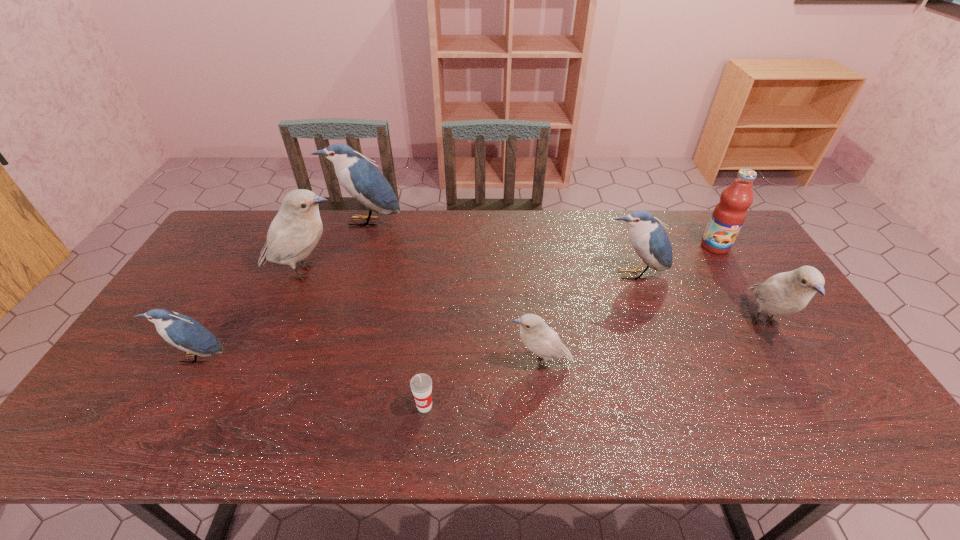
Identify the location of the fourth object from right to left. The image size is (960, 540). (536, 335).

Find the location of a particular element. Image resolution: width=960 pixels, height=540 pixels. the leftmost blue bird is located at coordinates (181, 331).

Where is `the nearest blue bird`? the nearest blue bird is located at coordinates point(181,331).

This screenshot has width=960, height=540. Identify the location of the nearest object. (421, 384).

At what (x,y) coordinates should I click in order to perform the action: click on the fourth object from left to right. Please return your answer as a coordinate pair (x, y). The image size is (960, 540). Looking at the image, I should click on (421, 384).

Identify the location of vacant space located 0.370m at the tip of the farthest object's beak. This screenshot has height=540, width=960. (337, 307).

I want to click on free space located at the beak of the biggest white bird, so click(370, 272).

You are a GUI agent. You are given a task and a screenshot of the screen. Output one action in this format:
    pyautogui.click(x=<x>, y=<y>)
    Task: Click on the vacant space located 0.400m on the front label of the fruit juice
    This screenshot has height=540, width=960.
    Given the screenshot: What is the action you would take?
    pyautogui.click(x=781, y=353)

You are a GUI agent. You are given a task and a screenshot of the screen. Output one action in this format:
    pyautogui.click(x=<x>, y=<y>)
    Task: Click on the free space located at the tip of the rightmost blue bird's beak
    The image size is (960, 540).
    Given the screenshot: What is the action you would take?
    pyautogui.click(x=679, y=396)

Identify the location of blank space located 0.080m at the beak of the rightmost white bird. (799, 379).